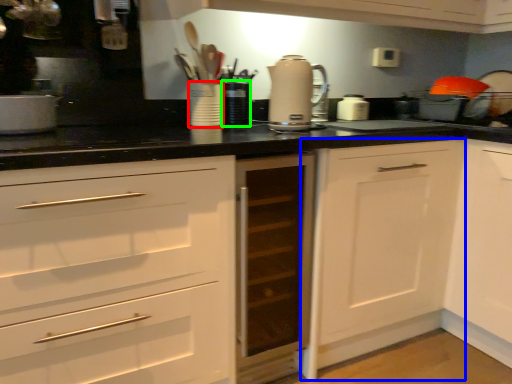
Question: Which object is the closest to the appliance (highlighted by a red box)? Choose among these: cabinetry (highlighted by a blue box) or appliance (highlighted by a green box).

Choices:
 (A) cabinetry
 (B) appliance

Answer: (B)